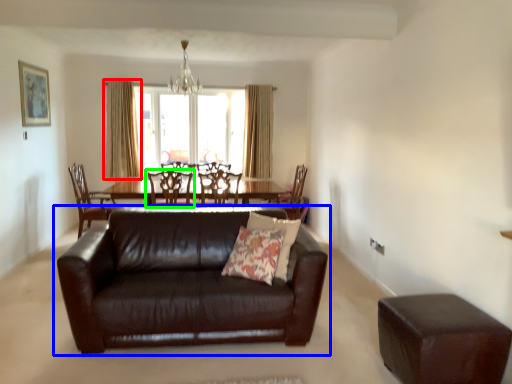
Question: Estimate the real-world distances between objects in this image. Which object is closer to curtain (highlighted by a red box), studio couch (highlighted by a blue box) or chair (highlighted by a green box)?

Choices:
 (A) studio couch
 (B) chair

Answer: (B)